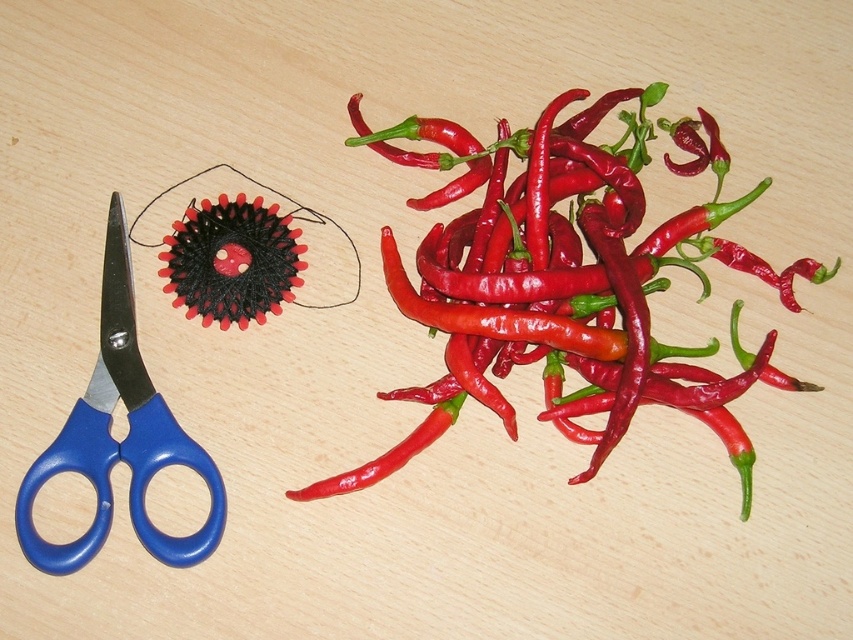
Can you confirm if smooth red chili peppers at upper right is smaller than blue plastic scissors at left?

Incorrect, smooth red chili peppers at upper right is not smaller in size than blue plastic scissors at left.

Can you confirm if smooth red chili peppers at upper right is bigger than blue plastic scissors at left?

Yes.

Where is `smooth red chili peppers at upper right`? smooth red chili peppers at upper right is located at coordinates (564, 291).